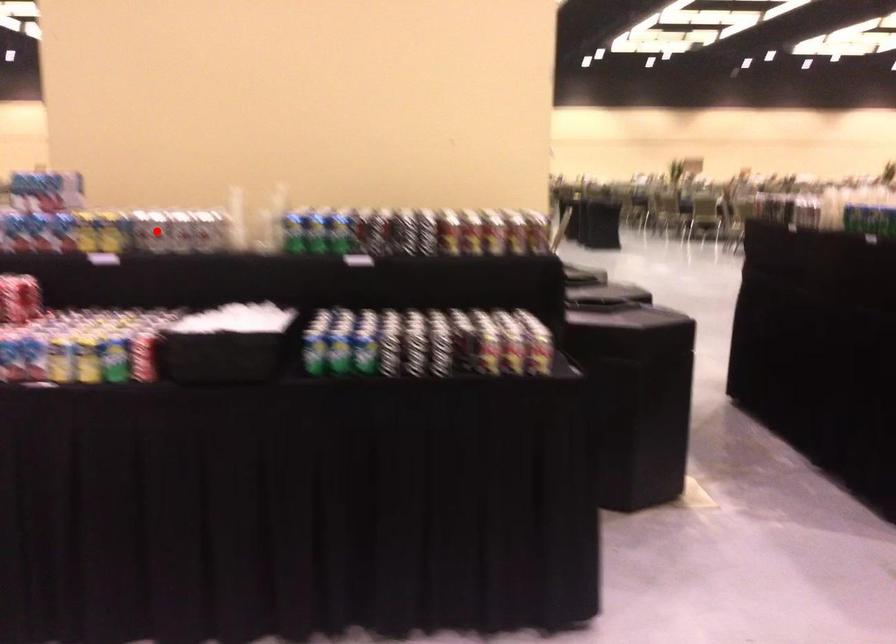
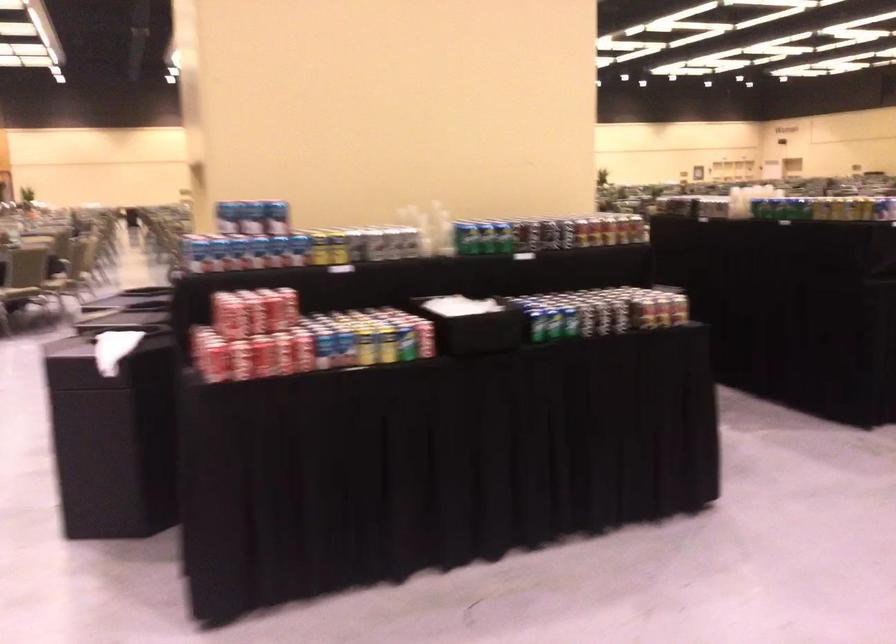
Question: I am providing you with two images of the same scene from different viewpoints. In image1, a red point is highlighted. Considering the same 3D point in image2, which of the following is correct?

Choices:
 (A) It is closer
 (B) It is farther

Answer: (B)